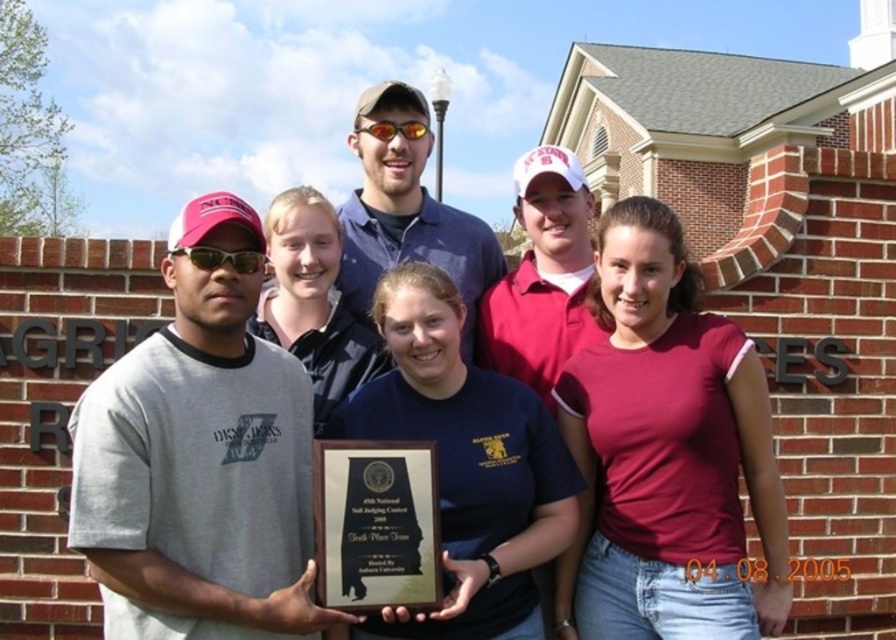
Is point (105, 624) positioned in front of point (412, 124)?

Yes, it is.

Between gray cotton t-shirt at left and shiny orange plastic goggles at center, which one appears on the right side from the viewer's perspective?

shiny orange plastic goggles at center is more to the right.

Which is in front, point (175, 288) or point (415, 129)?

Point (175, 288)

Identify the location of gray cotton t-shirt at left. Image resolution: width=896 pixels, height=640 pixels. (199, 476).

Which of these two, gray cotton t-shirt at left or matte blue shirt at center, stands shorter?

Standing shorter between the two is gray cotton t-shirt at left.

Which is in front, point (308, 388) or point (560, 177)?

Point (308, 388)

Locate an element on the screen. gray cotton t-shirt at left is located at coordinates (199, 476).

Find the location of a particular element. gray cotton t-shirt at left is located at coordinates (199, 476).

Which is behind, point (395, 172) or point (390, 131)?

Positioned behind is point (390, 131).

Does blue denim shirt at center have a smaller size compared to shiny orange plastic goggles at center?

Actually, blue denim shirt at center might be larger than shiny orange plastic goggles at center.

Where is `blue denim shirt at center`? The height and width of the screenshot is (640, 896). blue denim shirt at center is located at coordinates (409, 230).

Identify the location of blue denim shirt at center. This screenshot has width=896, height=640. (409, 230).